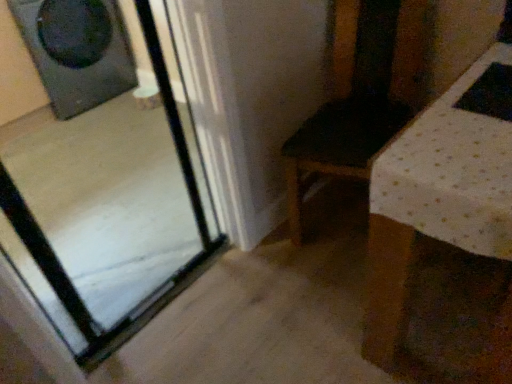
Question: Is transparent glass door at left facing away from matte black speaker at upper left?

Choices:
 (A) yes
 (B) no

Answer: (B)

Question: Does transparent glass door at left have a greater height compared to matte black speaker at upper left?

Choices:
 (A) yes
 (B) no

Answer: (A)

Question: From the image's perspective, is transparent glass door at left under matte black speaker at upper left?

Choices:
 (A) no
 (B) yes

Answer: (B)

Question: Does transparent glass door at left appear on the right side of matte black speaker at upper left?

Choices:
 (A) no
 (B) yes

Answer: (B)

Question: Considering the relative sizes of transparent glass door at left and matte black speaker at upper left in the image provided, is transparent glass door at left smaller than matte black speaker at upper left?

Choices:
 (A) yes
 (B) no

Answer: (A)

Question: Considering the relative sizes of transparent glass door at left and matte black speaker at upper left in the image provided, is transparent glass door at left shorter than matte black speaker at upper left?

Choices:
 (A) yes
 (B) no

Answer: (B)

Question: From the image's perspective, is matte black speaker at upper left located above transparent glass door at left?

Choices:
 (A) no
 (B) yes

Answer: (B)

Question: Is matte black speaker at upper left positioned in front of transparent glass door at left?

Choices:
 (A) no
 (B) yes

Answer: (A)

Question: Can you confirm if matte black speaker at upper left is smaller than transparent glass door at left?

Choices:
 (A) no
 (B) yes

Answer: (A)

Question: Does matte black speaker at upper left have a greater width compared to transparent glass door at left?

Choices:
 (A) no
 (B) yes

Answer: (B)

Question: Is the depth of matte black speaker at upper left greater than that of transparent glass door at left?

Choices:
 (A) yes
 (B) no

Answer: (A)

Question: Does matte black speaker at upper left have a larger size compared to transparent glass door at left?

Choices:
 (A) yes
 (B) no

Answer: (A)

Question: From a real-world perspective, is transparent glass door at left positioned above or below matte black speaker at upper left?

Choices:
 (A) below
 (B) above

Answer: (B)